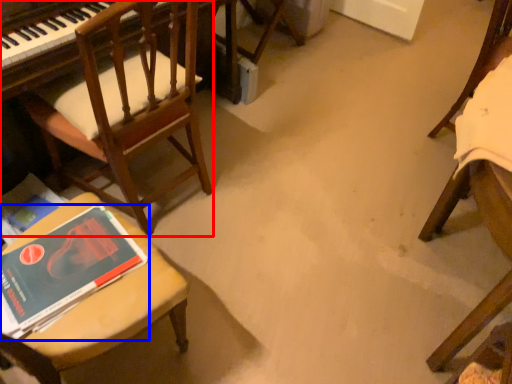
Question: Which object appears closest to the camera in this image, chair (highlighted by a red box) or book (highlighted by a blue box)?

Choices:
 (A) chair
 (B) book

Answer: (B)